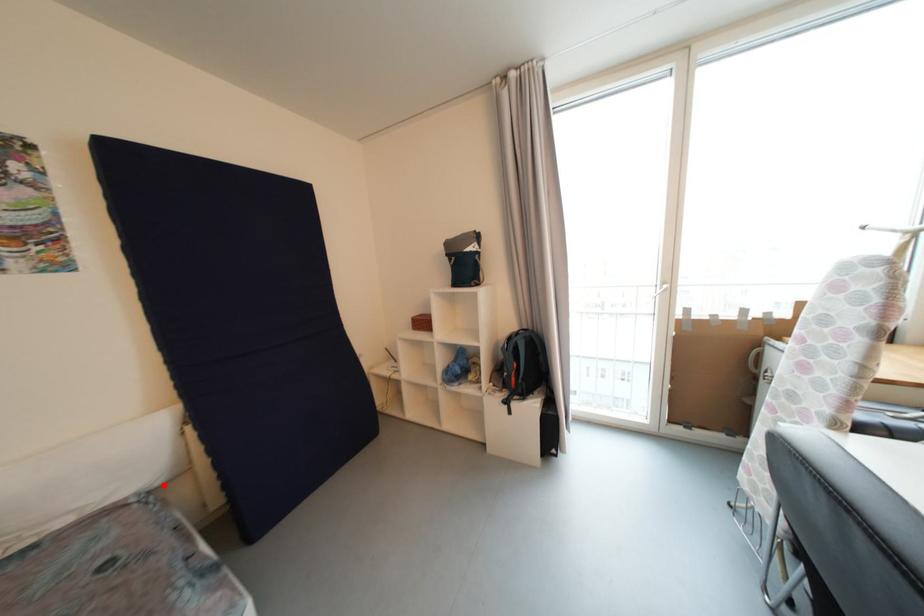
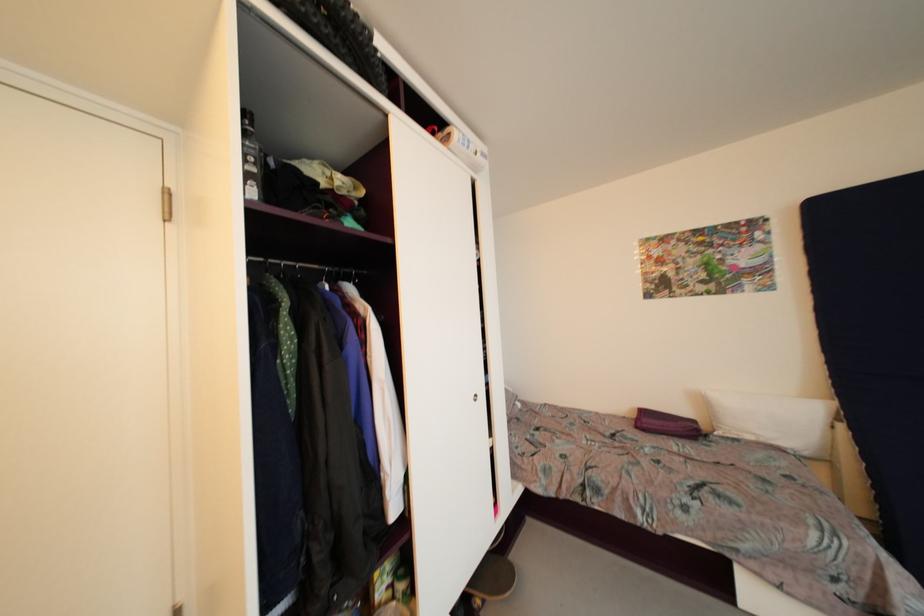
Question: I am providing you with two images of the same scene from different viewpoints. A red point is shown in image1. For the corresponding object point in image2, is it positioned nearer or farther from the camera?

Choices:
 (A) Nearer
 (B) Farther

Answer: (B)